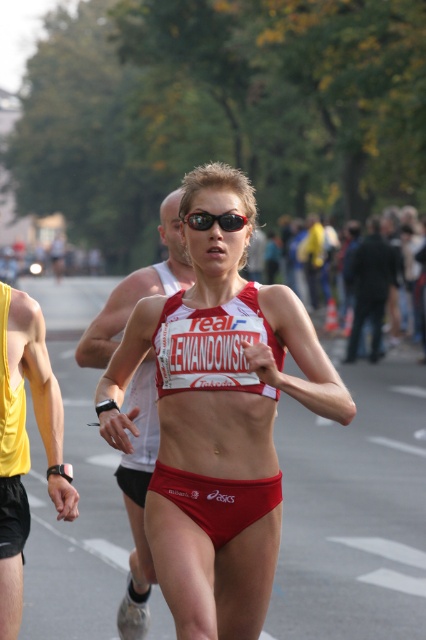
Who is higher up, white mesh tank top at center or yellow fabric tank top at left?

white mesh tank top at center is above.

Is white mesh tank top at center positioned behind yellow fabric tank top at left?

No, white mesh tank top at center is closer to the viewer.

Between point (149, 433) and point (16, 586), which one is positioned behind?

Point (149, 433)

You are a GUI agent. You are given a task and a screenshot of the screen. Output one action in this format:
    pyautogui.click(x=<x>, y=<y>)
    Task: Click on the white mesh tank top at center
    This screenshot has height=640, width=426.
    Given the screenshot: What is the action you would take?
    pyautogui.click(x=138, y=500)

Is matte red bikini at center bigger than white mesh tank top at center?

No, matte red bikini at center is not bigger than white mesh tank top at center.

Who is positioned more to the right, matte red bikini at center or white mesh tank top at center?

matte red bikini at center is more to the right.

I want to click on matte red bikini at center, so click(218, 417).

Locate an element on the screen. matte red bikini at center is located at coordinates (218, 417).

Who is more distant from viewer, [126,305] or [397,256]?

Point [397,256]

Is white mesh tank top at center to the right of black fabric jacket at upper center from the viewer's perspective?

No, white mesh tank top at center is not to the right of black fabric jacket at upper center.

Describe the element at coordinates (138, 500) in the screenshot. This screenshot has width=426, height=640. I see `white mesh tank top at center` at that location.

Locate an element on the screen. The image size is (426, 640). white mesh tank top at center is located at coordinates (138, 500).